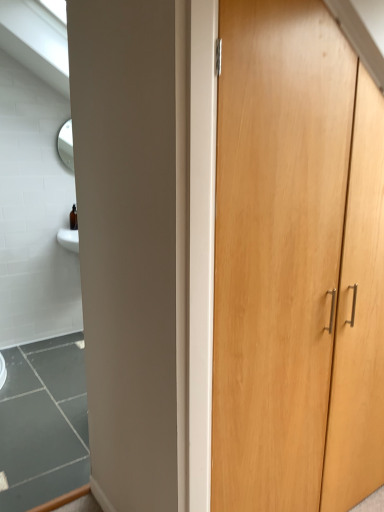
Question: Based on their positions, is light wood cupboard at right located to the left or right of white glossy window at upper left?

Choices:
 (A) left
 (B) right

Answer: (B)

Question: In terms of width, does light wood cupboard at right look wider or thinner when compared to white glossy window at upper left?

Choices:
 (A) thin
 (B) wide

Answer: (A)

Question: Considering their positions, is light wood cupboard at right located in front of or behind white glossy window at upper left?

Choices:
 (A) behind
 (B) front

Answer: (B)

Question: Is point (1, 6) positioned closer to the camera than point (286, 261)?

Choices:
 (A) closer
 (B) farther

Answer: (B)

Question: In terms of height, does white glossy window at upper left look taller or shorter compared to light wood cupboard at right?

Choices:
 (A) short
 (B) tall

Answer: (A)

Question: From the image's perspective, is white glossy window at upper left positioned above or below light wood cupboard at right?

Choices:
 (A) above
 (B) below

Answer: (A)

Question: Would you say white glossy window at upper left is inside or outside light wood cupboard at right?

Choices:
 (A) inside
 (B) outside

Answer: (B)